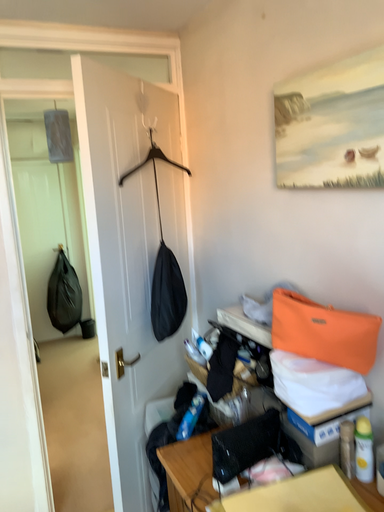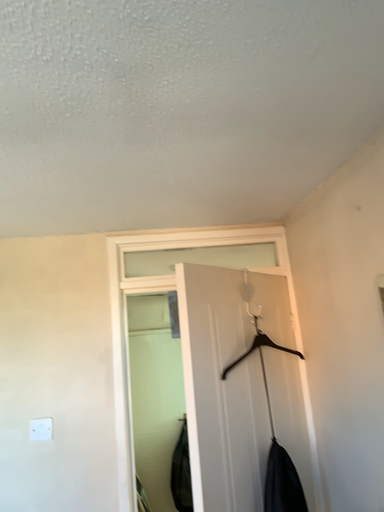
Question: How did the camera likely rotate when shooting the video?

Choices:
 (A) rotated left
 (B) rotated right

Answer: (A)